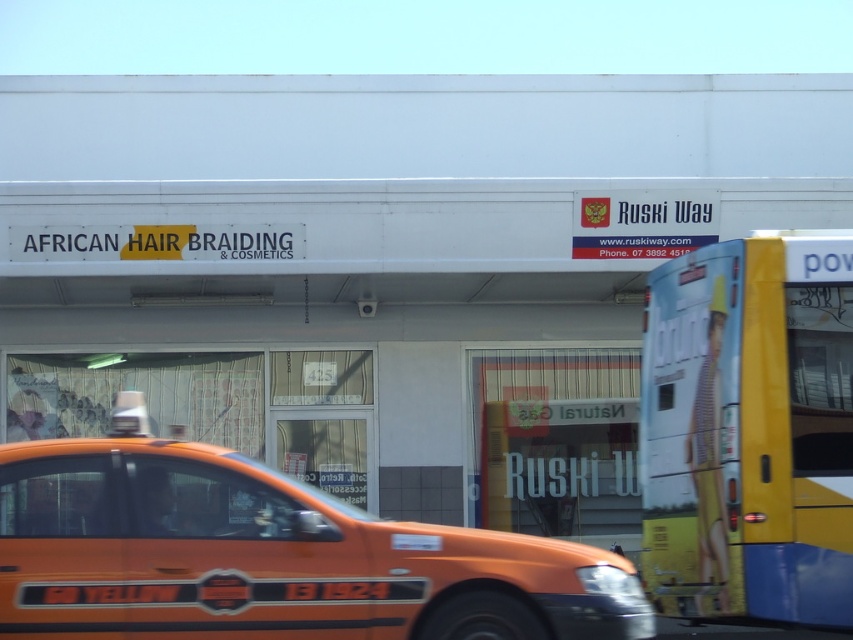
The height and width of the screenshot is (640, 853). What do you see at coordinates (267, 556) in the screenshot? I see `orange matte taxi at center` at bounding box center [267, 556].

Between orange matte taxi at center and yellow matte bus at right, which one has more height?

yellow matte bus at right

Who is more distant from viewer, (x=492, y=618) or (x=688, y=276)?

The point (x=688, y=276) is behind.

Where is `orange matte taxi at center`? Image resolution: width=853 pixels, height=640 pixels. orange matte taxi at center is located at coordinates click(x=267, y=556).